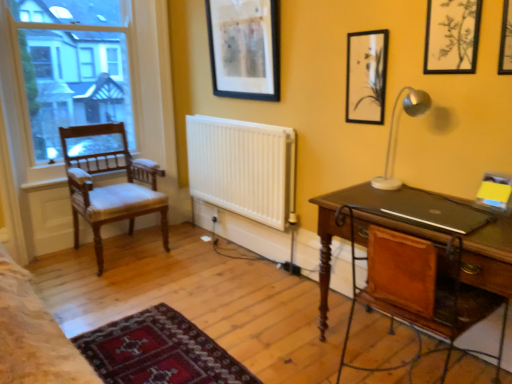
Question: In terms of size, does black matte laptop at right appear bigger or smaller than matte black picture frame at upper right, the 3th picture frame when ordered from front to back?

Choices:
 (A) small
 (B) big

Answer: (A)

Question: Does point (412, 210) appear closer or farther from the camera than point (375, 44)?

Choices:
 (A) closer
 (B) farther

Answer: (A)

Question: Which object is the closest to the matte black picture frame at upper center, placed as the first picture frame when sorted from back to front?

Choices:
 (A) black matte picture frame at upper right, the 3th picture frame in the back-to-front sequence
 (B) clear glass window at left
 (C) white matte radiator at center
 (D) light brown wood chair at left
 (E) matte black picture frame at upper right, which is the 2th picture frame in back-to-front order

Answer: (C)

Question: Considering the real-world distances, which object is farthest from the matte black picture frame at upper center, positioned as the fourth picture frame in front-to-back order?

Choices:
 (A) white matte radiator at center
 (B) clear glass window at left
 (C) black matte picture frame at upper right, placed as the fourth picture frame when sorted from left to right
 (D) matte black picture frame at upper right, which is the 2th picture frame in back-to-front order
 (E) black matte laptop at right

Answer: (C)